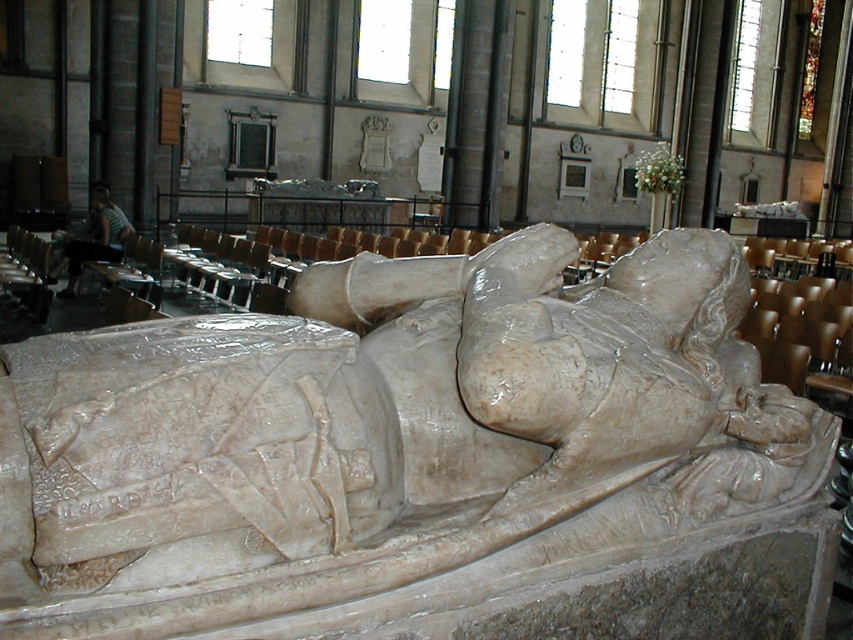
Does white marble statue at center come in front of light brown wooden chair at lower left?

Yes, it is in front of light brown wooden chair at lower left.

Between white marble statue at center and light brown wooden chair at lower left, which one is positioned lower?

white marble statue at center

At what (x,y) coordinates should I click in order to perform the action: click on white marble statue at center. Please return your answer as a coordinate pair (x, y). Looking at the image, I should click on (419, 460).